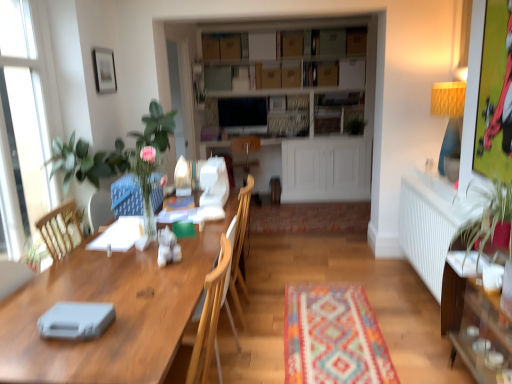
Question: Does point (287, 162) appear closer or farther from the camera than point (198, 291)?

Choices:
 (A) farther
 (B) closer

Answer: (A)

Question: Is cardboard boxes at center in front of or behind wooden table at center in the image?

Choices:
 (A) front
 (B) behind

Answer: (B)

Question: Considering the real-world distances, which object is closest to the wooden chair at center?

Choices:
 (A) multicolored woven mat at center
 (B) cardboard boxes at center
 (C) wooden table at center
 (D) matte black picture frame at upper left
 (E) white glass window at left

Answer: (C)

Question: Which object is positioned farthest from the white glass window at left?

Choices:
 (A) wooden cabinet at right
 (B) matte black picture frame at upper left
 (C) cardboard boxes at center
 (D) black glossy television at upper center
 (E) white radiator at right

Answer: (C)